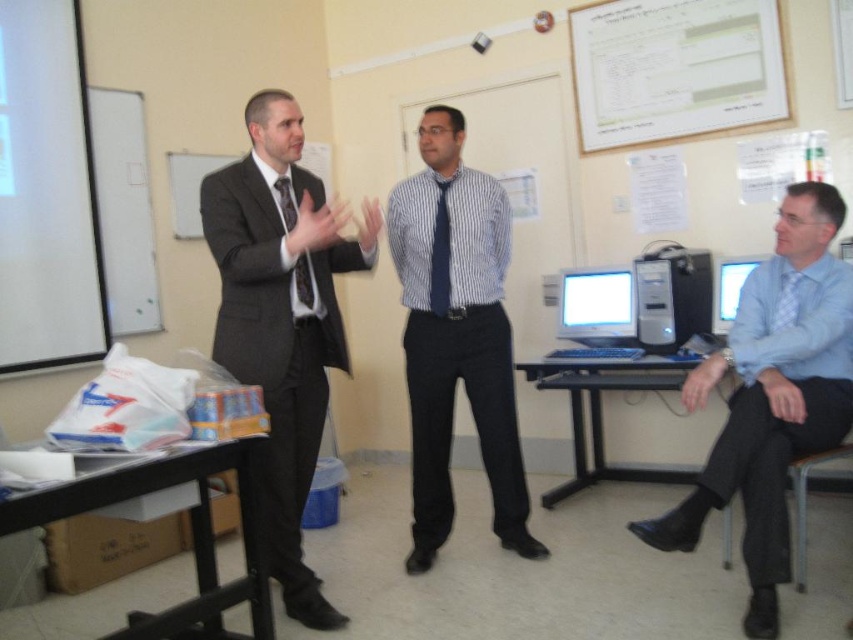
Does light blue shirt at right have a smaller size compared to black plastic table at lower right?

Incorrect, light blue shirt at right is not smaller in size than black plastic table at lower right.

Is the position of light blue shirt at right less distant than that of black plastic table at lower right?

Yes.

What do you see at coordinates (773, 394) in the screenshot? Image resolution: width=853 pixels, height=640 pixels. I see `light blue shirt at right` at bounding box center [773, 394].

Where is `light blue shirt at right`? light blue shirt at right is located at coordinates (773, 394).

How much distance is there between light blue shirt at right and black plastic table at lower left?

light blue shirt at right is 4.96 feet from black plastic table at lower left.

Can you confirm if light blue shirt at right is bigger than black plastic table at lower left?

Yes, light blue shirt at right is bigger than black plastic table at lower left.

Does point (792, 448) lie in front of point (260, 634)?

No, (792, 448) is further to viewer.

Image resolution: width=853 pixels, height=640 pixels. Find the location of `light blue shirt at right`. light blue shirt at right is located at coordinates (773, 394).

Which is below, light blue shirt at right or matte black monitor at center?

light blue shirt at right is lower down.

Between light blue shirt at right and matte black monitor at center, which one appears on the right side from the viewer's perspective?

light blue shirt at right

This screenshot has width=853, height=640. What do you see at coordinates (773, 394) in the screenshot?
I see `light blue shirt at right` at bounding box center [773, 394].

Identify the location of light blue shirt at right. Image resolution: width=853 pixels, height=640 pixels. (773, 394).